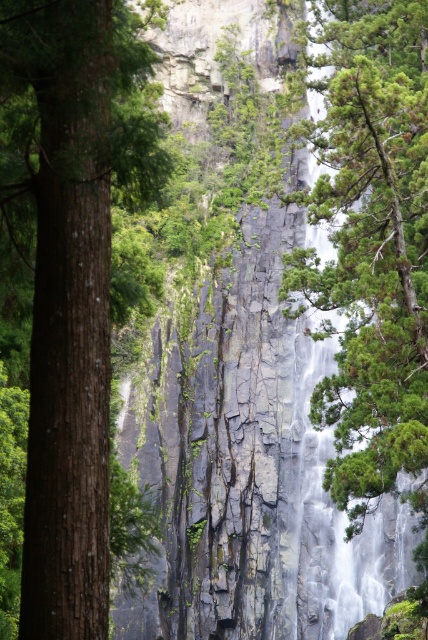
You are a hiker trying to determine which tree to climb for a better view. The brown rough tree trunk at left and the green textured tree at right are both within reach. Based on their sizes, which tree would you choose and why?

The brown rough tree trunk at left is bigger than the green textured tree at right, so you should choose the brown rough tree trunk at left because it is larger and more stable for climbing.

Based on the photo, you are a hiker standing at the base of the waterfall and want to take a photo of both the brown rough tree trunk at left and the green textured tree at right. Which tree should you move closer to in order to include both in your frame?

You should move closer to the green textured tree at right because the brown rough tree trunk at left is positioned over the green textured tree at right, meaning it is closer to you. By moving toward the farther tree, you can better balance their sizes in the photo.